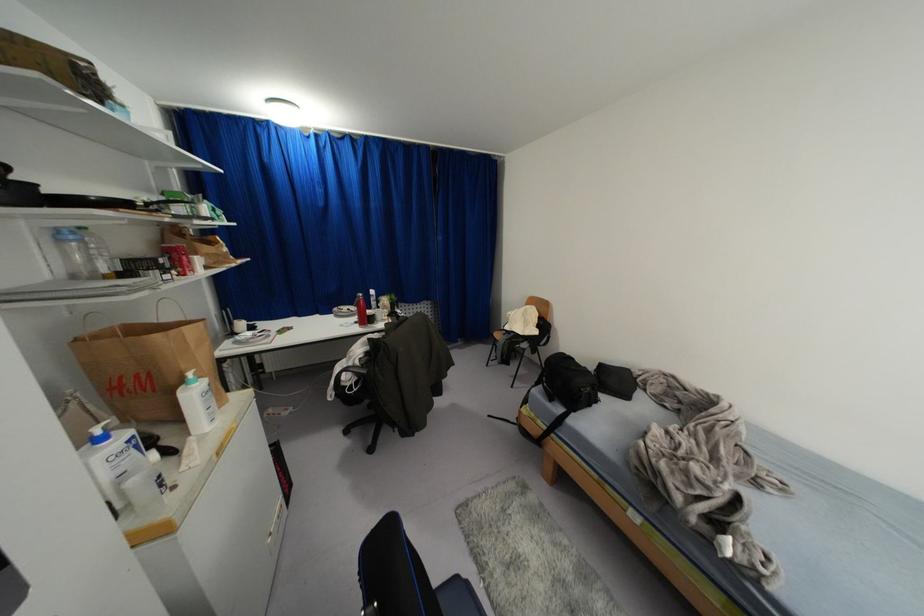
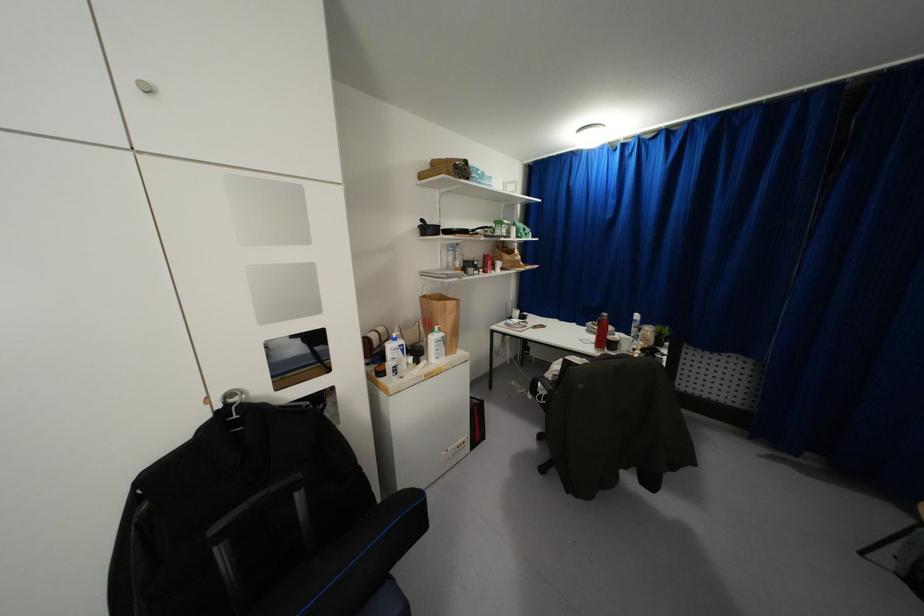
Locate, in the second image, the point that corresponds to the point at 359,359 in the first image.

(553, 376)